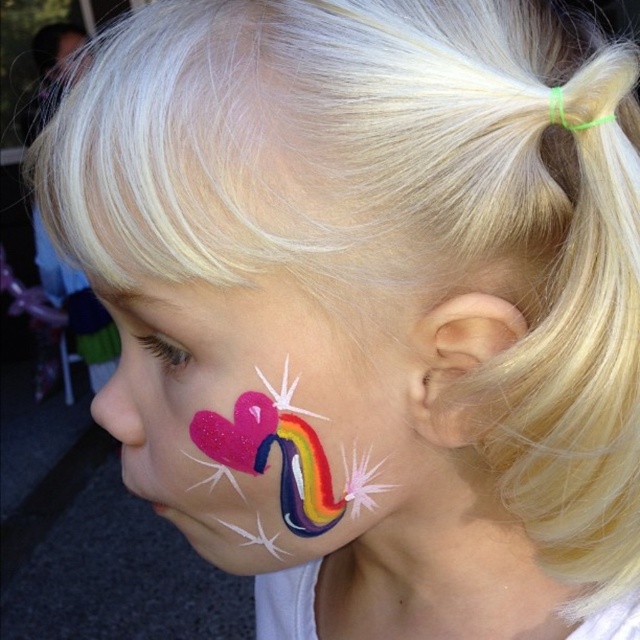
You are a photographer standing at the camera position. You want to capture a closeup shot of the face painting on the child. The focus point for the camera is set at point (269, 381). Considering the distance between the camera and this point, what is the minimum distance you should maintain to ensure the face painting is in focus?

The distance between the camera and point (269, 381) is 12.97 inches. To ensure the face painting is in focus, you should maintain a distance of at least 12.97 inches from the camera to that point.

The child has a shiny pink heart at left and a pink matte ear at right on their face. Which one is positioned more to the left side of the child?

The shiny pink heart at left is positioned more to the left side of the child than the pink matte ear at right.

You are a photographer trying to capture the child with the shiny pink heart at left and the pink matte ear at right. Which object should you focus on if you want to photograph the taller one?

The shiny pink heart at left is taller than the pink matte ear at right, so you should focus on the shiny pink heart at left to capture the taller one.